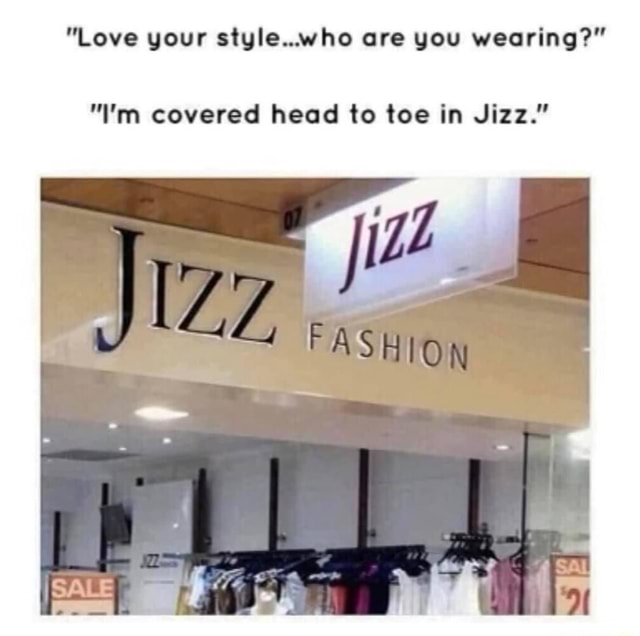
Where is `lights`? lights is located at coordinates [502, 446], [157, 417], [166, 441], [112, 424], [123, 448], [47, 439].